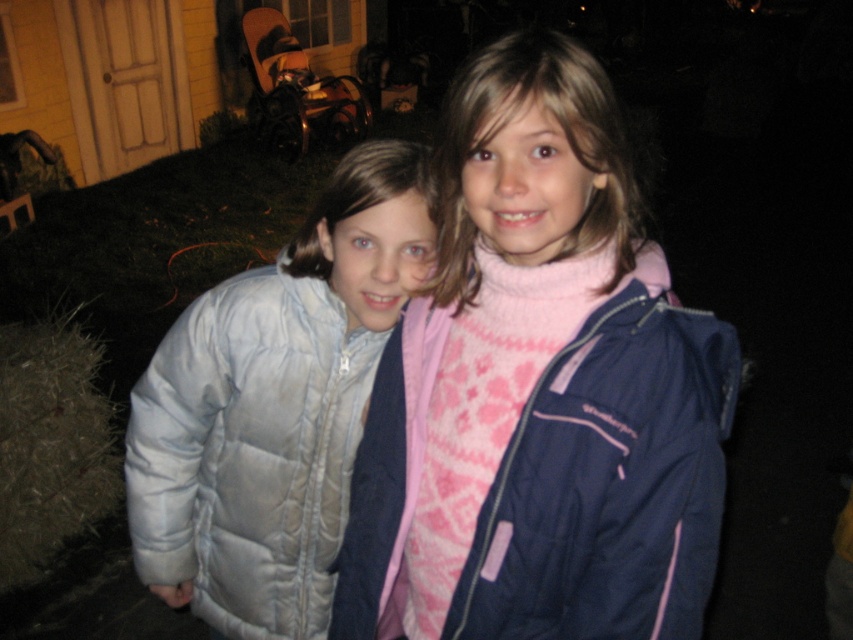
You are a photographer trying to capture both the pink quilted jacket at center and the light gray quilted jacket at left in a single shot. Based on their positions, which jacket should you focus on first to ensure both are in frame?

The pink quilted jacket at center is to the right of the light gray quilted jacket at left. Therefore, to capture both in a single shot, you should focus on the light gray quilted jacket at left first as it is positioned farther left, ensuring the camera frame includes both jackets from left to right.

You are a photographer trying to capture a group photo of the two children wearing the pink quilted jacket at center and the light gray quilted jacket at left. The minimum focus distance for your camera is 12 inches. Will you be able to focus on both children if they are positioned exactly as shown?

The pink quilted jacket at center is 12.47 inches away from the light gray quilted jacket at left. Since the distance between them is greater than the camera minimum focus distance of 12 inches, the camera can focus on both children as they are within the required range.

You are a photographer trying to capture the pink quilted jacket at center in the center of your camera frame. Given its current position at point 0.611, 0.634, do you need to adjust your camera to the left or right to center it?

The pink quilted jacket at center is already positioned at point (540, 390), which is the center of the frame. Therefore, no adjustment is needed.